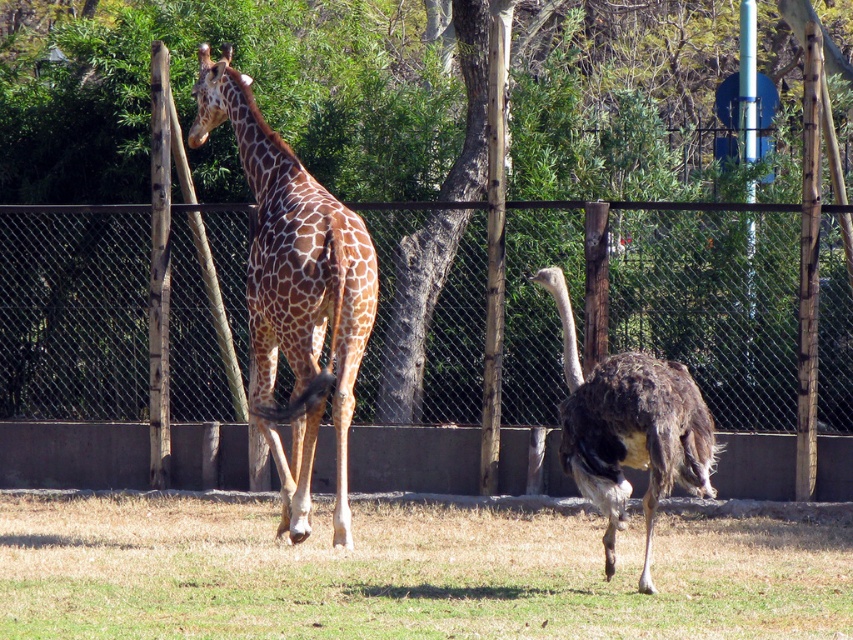
Question: Can you confirm if green dry grass at lower center is positioned below brown feathered ostrich at center?

Choices:
 (A) yes
 (B) no

Answer: (A)

Question: Does brown spotted giraffe at center have a larger size compared to brown feathered ostrich at center?

Choices:
 (A) no
 (B) yes

Answer: (B)

Question: Which of these objects is positioned closest to the brown feathered ostrich at center?

Choices:
 (A) metallic wire mesh at center
 (B) green dry grass at lower center
 (C) brown spotted giraffe at center

Answer: (C)

Question: Which of these objects is positioned farthest from the brown feathered ostrich at center?

Choices:
 (A) green dry grass at lower center
 (B) metallic wire mesh at center
 (C) brown spotted giraffe at center

Answer: (B)

Question: Is green dry grass at lower center below brown spotted giraffe at center?

Choices:
 (A) no
 (B) yes

Answer: (B)

Question: Which object is farther from the camera taking this photo?

Choices:
 (A) metallic wire mesh at center
 (B) brown feathered ostrich at center
 (C) brown spotted giraffe at center
 (D) green dry grass at lower center

Answer: (A)